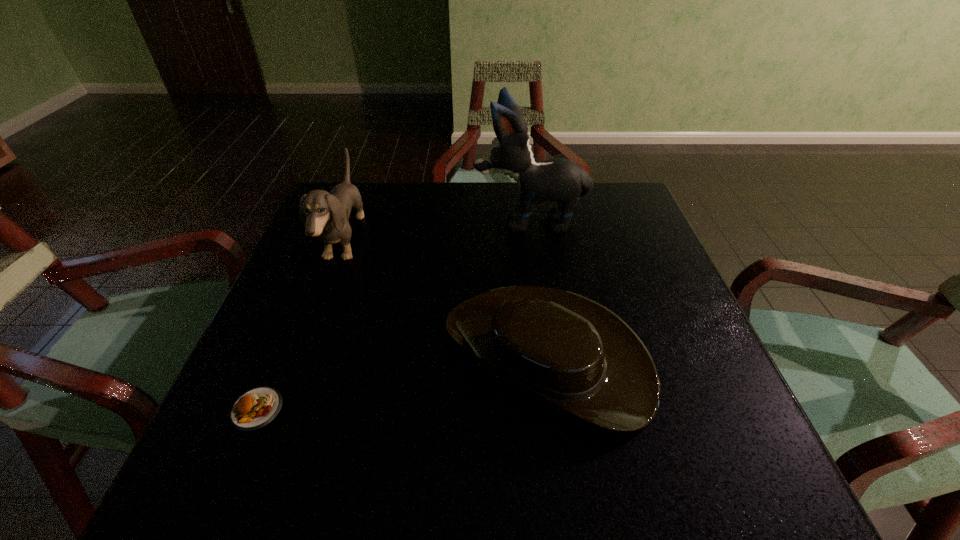
The height and width of the screenshot is (540, 960). I want to click on the taller puppy, so click(558, 179).

At what (x,y) coordinates should I click in order to perform the action: click on the right puppy. Please return your answer as a coordinate pair (x, y). Image resolution: width=960 pixels, height=540 pixels. Looking at the image, I should click on (558, 179).

Image resolution: width=960 pixels, height=540 pixels. I want to click on the shorter puppy, so pyautogui.click(x=325, y=215).

The image size is (960, 540). In order to click on the left puppy in this screenshot , I will do `click(325, 215)`.

I want to click on cowboy hat, so click(563, 350).

I want to click on the shortest object, so click(254, 409).

Where is `vacant space positioned on the front-facing side of the tallest object`? The image size is (960, 540). vacant space positioned on the front-facing side of the tallest object is located at coordinates (345, 221).

At what (x,y) coordinates should I click in order to perform the action: click on free space located 0.080m on the front-facing side of the tallest object. Please return your answer as a coordinate pair (x, y). This screenshot has height=540, width=960. Looking at the image, I should click on (443, 221).

This screenshot has height=540, width=960. What are the coordinates of `vacant space located on the front-facing side of the tallest object` in the screenshot? It's located at (368, 221).

This screenshot has width=960, height=540. What are the coordinates of `vacant region located at the face of the shorter puppy` in the screenshot? It's located at (477, 241).